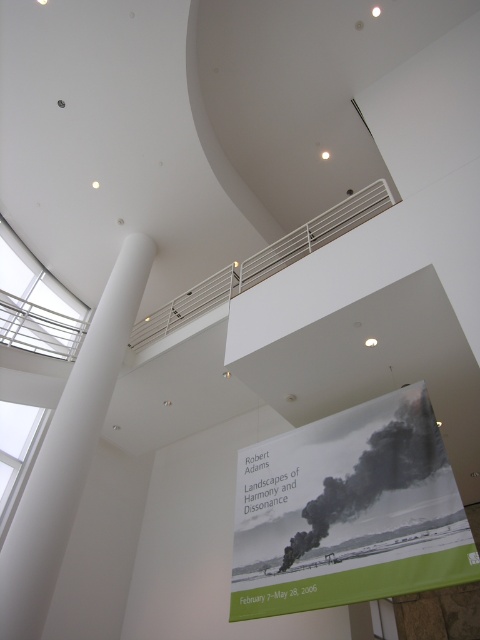
You are standing in the modern building and want to reach the point at coordinates point (265, 605). Can you estimate how far you need to walk to reach that point?

The point (265, 605) is 15.35 feet away from the viewer, so you need to walk approximately 15.35 feet to reach it.

You are an architect designing a new exhibit space. You need to install a large sculpture that requires a minimum height clearance of 3 meters. Given the white smooth column at center and the white metal rail at upper center, which object would you consider for ensuring the sculpture can fit vertically without obstruction?

The white smooth column at center is much taller than the white metal rail at upper center, so the sculpture should be placed near the white metal rail at upper center to ensure sufficient vertical clearance.